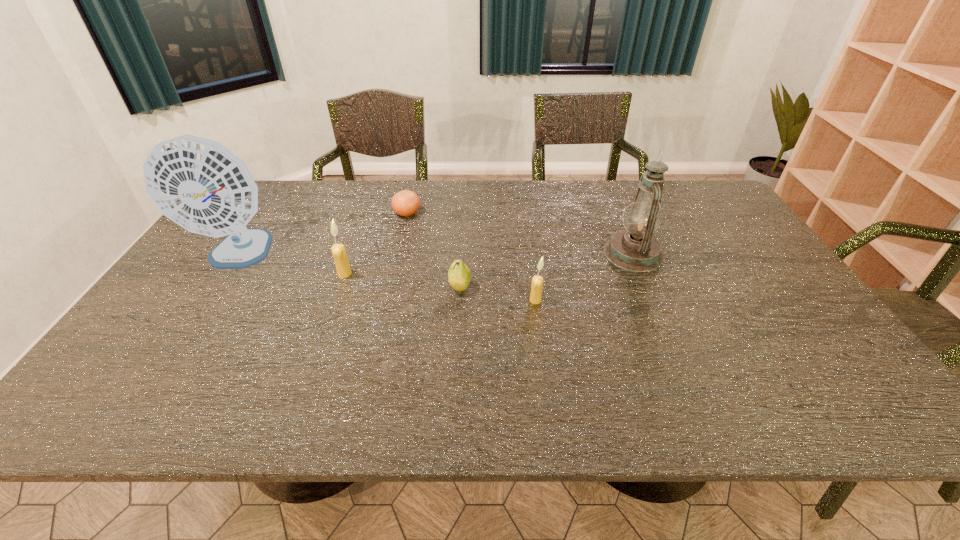
Where is `the fifth object from right to left`? the fifth object from right to left is located at coordinates click(x=338, y=250).

At what (x,y) coordinates should I click in order to perform the action: click on the third tallest object. Please return your answer as a coordinate pair (x, y). Looking at the image, I should click on (338, 250).

This screenshot has width=960, height=540. What are the coordinates of `the shorter candle` in the screenshot? It's located at (537, 281).

Where is `the fifth object from left to right`? the fifth object from left to right is located at coordinates (537, 281).

This screenshot has width=960, height=540. In order to click on oil lamp in this screenshot , I will do `click(635, 249)`.

Where is `the second shortest object`? the second shortest object is located at coordinates (459, 275).

This screenshot has width=960, height=540. Identify the location of the third object from right to left. (459, 275).

Where is `clementine`? This screenshot has width=960, height=540. clementine is located at coordinates (405, 203).

Where is `the third object from left to right`? the third object from left to right is located at coordinates (405, 203).

I want to click on the leftmost object, so click(197, 183).